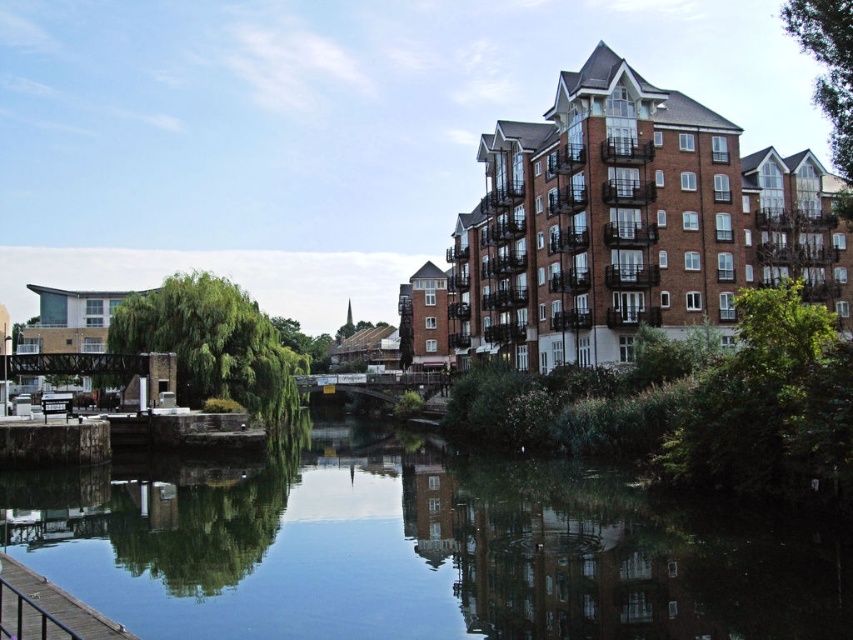
You are a drone operator trying to capture a photo of the riverside scene. You have two points marked on your screen for reference. Point A is at coordinates point (x=136, y=506) and Point B is at point (x=15, y=580). To ensure the building with balconies is fully visible in the photo, which point should you prioritize focusing on?

Point B at point (x=15, y=580) should be prioritized because Point A is behind it, so focusing on Point B will keep the building with balconies in the foreground and ensure it is fully visible.

You are standing on the brown wooden dock at lower left and want to walk to the smooth reflective water at center. Which direction should you head towards?

You should head towards the right, as the smooth reflective water at center is located to the right of the brown wooden dock at lower left.